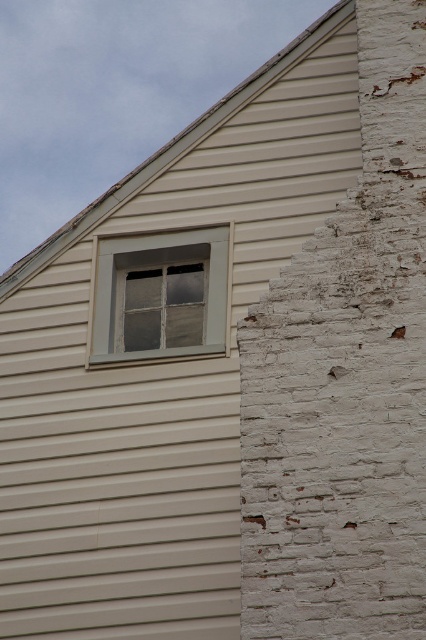
Question: Among these objects, which one is nearest to the camera?

Choices:
 (A) white painted brick siding at right
 (B) clear glass window at upper center

Answer: (A)

Question: Is white painted brick siding at right smaller than clear glass window at upper center?

Choices:
 (A) yes
 (B) no

Answer: (B)

Question: Can you confirm if white painted brick siding at right is smaller than clear glass window at upper center?

Choices:
 (A) yes
 (B) no

Answer: (B)

Question: Which object appears farthest from the camera in this image?

Choices:
 (A) clear glass window at upper center
 (B) white painted brick siding at right

Answer: (A)

Question: Can you confirm if white painted brick siding at right is bigger than clear glass window at upper center?

Choices:
 (A) no
 (B) yes

Answer: (B)